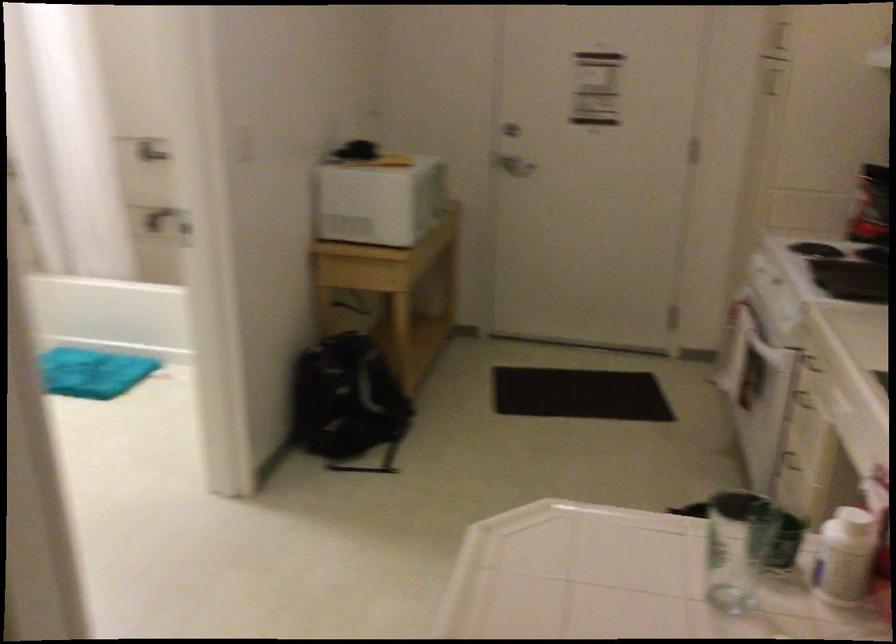
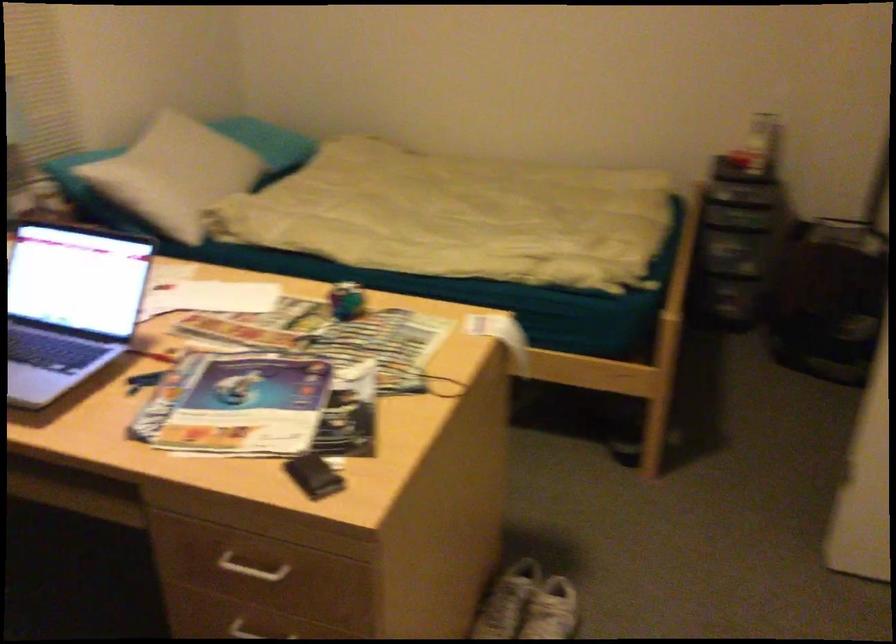
The images are taken continuously from a first-person perspective. In which direction is your viewpoint rotating?

The rotation direction of the camera is left-down.